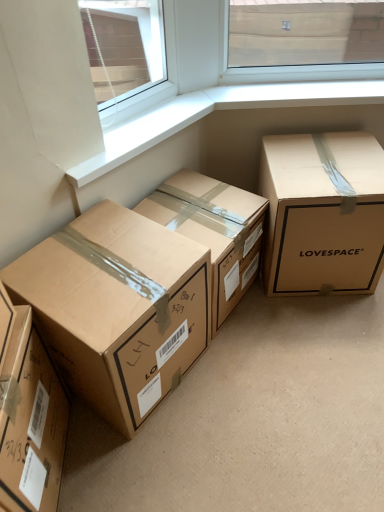
Identify the location of free point above white smooth window sill at upper center (from a real-world perspective). The width and height of the screenshot is (384, 512). (137, 126).